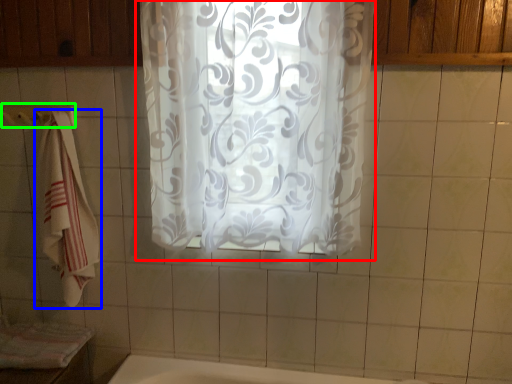
Question: Which is farther away from curtain (highlighted by a red box)? towel (highlighted by a blue box) or towel bar (highlighted by a green box)?

Choices:
 (A) towel
 (B) towel bar

Answer: (B)